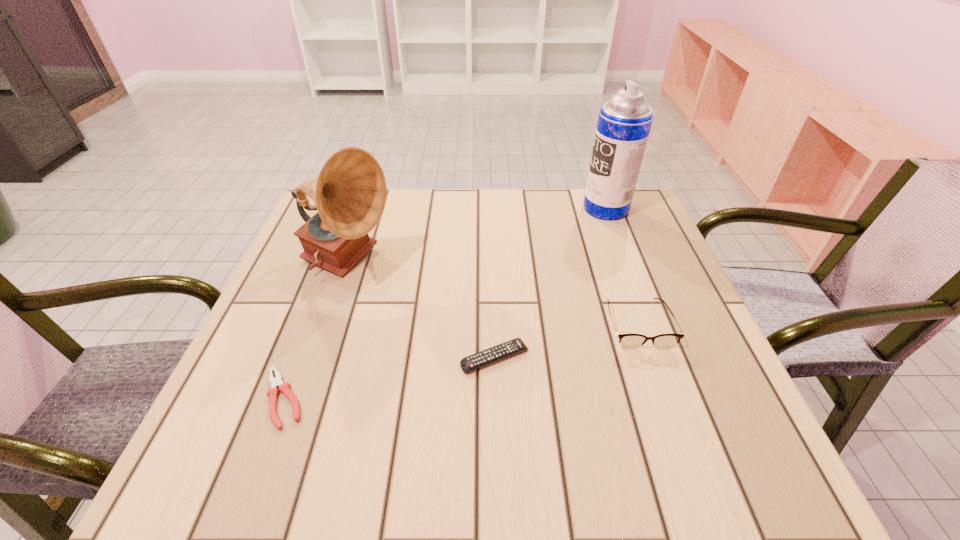
Find the location of a particular element. The height and width of the screenshot is (540, 960). vacant space situated 0.070m on the front of the remote control is located at coordinates (496, 409).

Where is `vacant area situated on the left of the pliers`? The height and width of the screenshot is (540, 960). vacant area situated on the left of the pliers is located at coordinates (225, 398).

Where is `aerosol can situated at the far edge`? The height and width of the screenshot is (540, 960). aerosol can situated at the far edge is located at coordinates (624, 122).

At what (x,y) coordinates should I click in order to perform the action: click on phonograph record that is positioned at the far edge. Please return your answer as a coordinate pair (x, y). Looking at the image, I should click on (349, 193).

Locate an element on the screen. This screenshot has height=540, width=960. object at the near edge is located at coordinates (284, 387).

Locate an element on the screen. This screenshot has width=960, height=540. phonograph record located at the left edge is located at coordinates (349, 193).

Where is `pliers at the left edge`? The height and width of the screenshot is (540, 960). pliers at the left edge is located at coordinates (284, 387).

Image resolution: width=960 pixels, height=540 pixels. I want to click on aerosol can positioned at the right edge, so point(624,122).

Where is `spectacles located in the right edge section of the desktop`? The image size is (960, 540). spectacles located in the right edge section of the desktop is located at coordinates (627, 341).

This screenshot has width=960, height=540. In order to click on object located in the far left corner section of the desktop in this screenshot , I will do `click(349, 193)`.